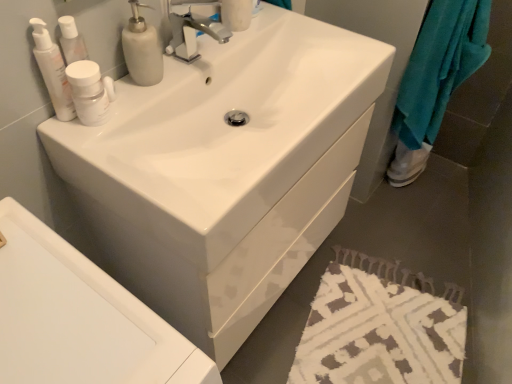
Question: From the image's perspective, does white textured bath mat at lower right appear higher than white matte bottle at upper left, which is the 2th mouthwash from left to right?

Choices:
 (A) yes
 (B) no

Answer: (B)

Question: Considering the relative sizes of white textured bath mat at lower right and white matte bottle at upper left, which is the 2th mouthwash from left to right, in the image provided, is white textured bath mat at lower right smaller than white matte bottle at upper left, which is the 2th mouthwash from left to right,?

Choices:
 (A) no
 (B) yes

Answer: (A)

Question: Considering the relative positions of white textured bath mat at lower right and white matte bottle at upper left, which appears as the 1th mouthwash when viewed from the right, in the image provided, is white textured bath mat at lower right behind white matte bottle at upper left, which appears as the 1th mouthwash when viewed from the right,?

Choices:
 (A) yes
 (B) no

Answer: (A)

Question: From a real-world perspective, is white textured bath mat at lower right below white matte bottle at upper left, which is the 2th mouthwash from left to right?

Choices:
 (A) no
 (B) yes

Answer: (B)

Question: Is white textured bath mat at lower right oriented towards white matte bottle at upper left, which is the 2th mouthwash from left to right?

Choices:
 (A) no
 (B) yes

Answer: (A)

Question: In terms of height, does white glossy sink at center look taller or shorter compared to white textured bath mat at lower right?

Choices:
 (A) short
 (B) tall

Answer: (B)

Question: From a real-world perspective, relative to white textured bath mat at lower right, is white glossy sink at center vertically above or below?

Choices:
 (A) below
 (B) above

Answer: (B)

Question: Looking at their shapes, would you say white glossy sink at center is wider or thinner than white textured bath mat at lower right?

Choices:
 (A) wide
 (B) thin

Answer: (B)

Question: Based on their positions, is white glossy sink at center located to the left or right of white textured bath mat at lower right?

Choices:
 (A) right
 (B) left

Answer: (B)

Question: Looking at the image, does white glossy sink at center seem bigger or smaller compared to white glossy sink at center?

Choices:
 (A) small
 (B) big

Answer: (B)

Question: Is white glossy sink at center in front of or behind white glossy sink at center in the image?

Choices:
 (A) behind
 (B) front

Answer: (B)

Question: Choose the correct answer: Is white glossy sink at center inside white glossy sink at center or outside it?

Choices:
 (A) inside
 (B) outside

Answer: (B)

Question: In the image, is white glossy sink at center on the left side or the right side of white glossy sink at center?

Choices:
 (A) left
 (B) right

Answer: (A)

Question: Is point (58, 274) closer or farther from the camera than point (131, 61)?

Choices:
 (A) closer
 (B) farther

Answer: (A)

Question: From the image's perspective, is white glossy sink at center located above or below white matte soap dispenser at upper left?

Choices:
 (A) above
 (B) below

Answer: (B)